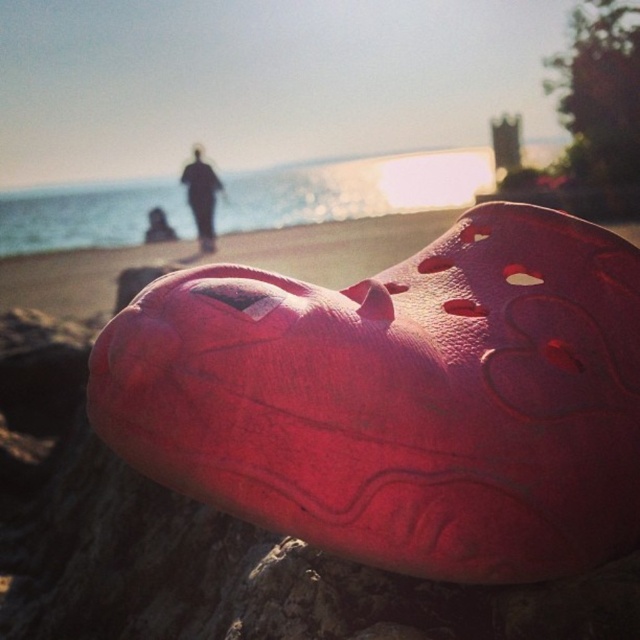
Question: Which object appears farthest from the camera in this image?

Choices:
 (A) black fabric person at center
 (B) smooth black jacket at center
 (C) rubber/crocs shoe at center

Answer: (B)

Question: Among these objects, which one is nearest to the camera?

Choices:
 (A) smooth black jacket at center
 (B) black fabric person at center
 (C) rubber/crocs shoe at center

Answer: (C)

Question: Among these points, which one is nearest to the camera?

Choices:
 (A) (161, 212)
 (B) (112, 381)
 (C) (189, 202)

Answer: (B)

Question: Is black fabric person at center above smooth black jacket at center?

Choices:
 (A) yes
 (B) no

Answer: (A)

Question: Is black fabric person at center further to camera compared to smooth black jacket at center?

Choices:
 (A) no
 (B) yes

Answer: (A)

Question: Considering the relative positions of black fabric person at center and smooth black jacket at center in the image provided, where is black fabric person at center located with respect to smooth black jacket at center?

Choices:
 (A) left
 (B) right

Answer: (B)